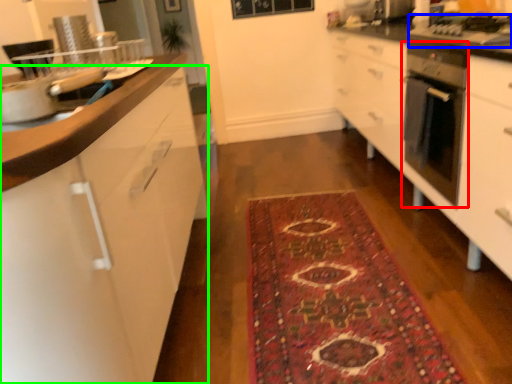
Question: Estimate the real-world distances between objects in this image. Which object is farther from home appliance (highlighted by a red box), gas stove (highlighted by a blue box) or cabinetry (highlighted by a green box)?

Choices:
 (A) gas stove
 (B) cabinetry

Answer: (B)